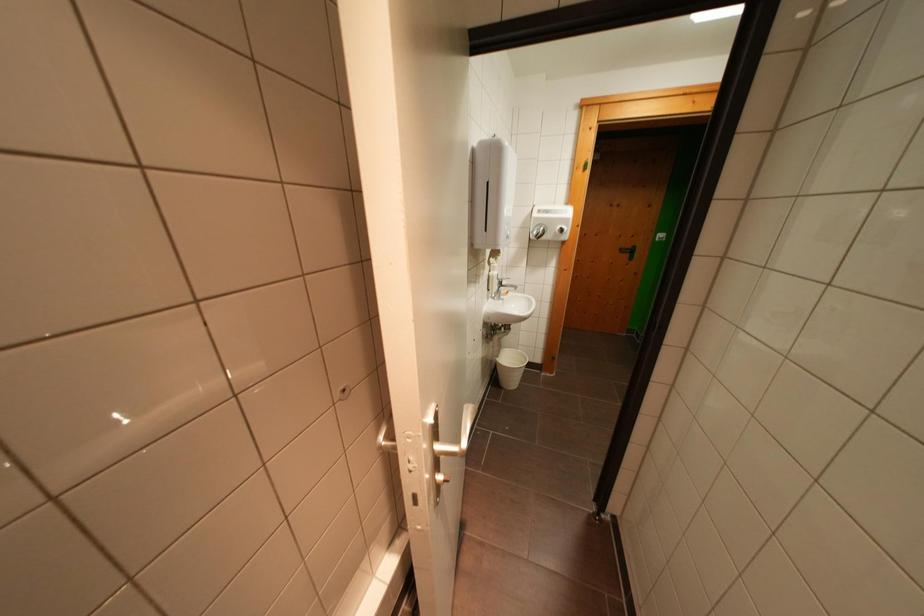
Where would you lift the small white bucket? Please return your answer as a coordinate pair (x, y).

(509, 367)